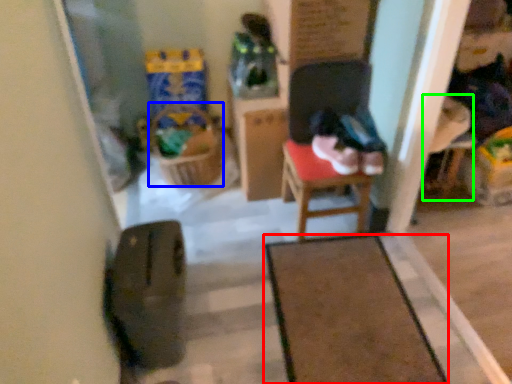
Question: Which object is positioned closest to furniture (highlighted by a red box)? Select from laundry basket (highlighted by a blue box) and armchair (highlighted by a green box).

Choices:
 (A) laundry basket
 (B) armchair

Answer: (B)